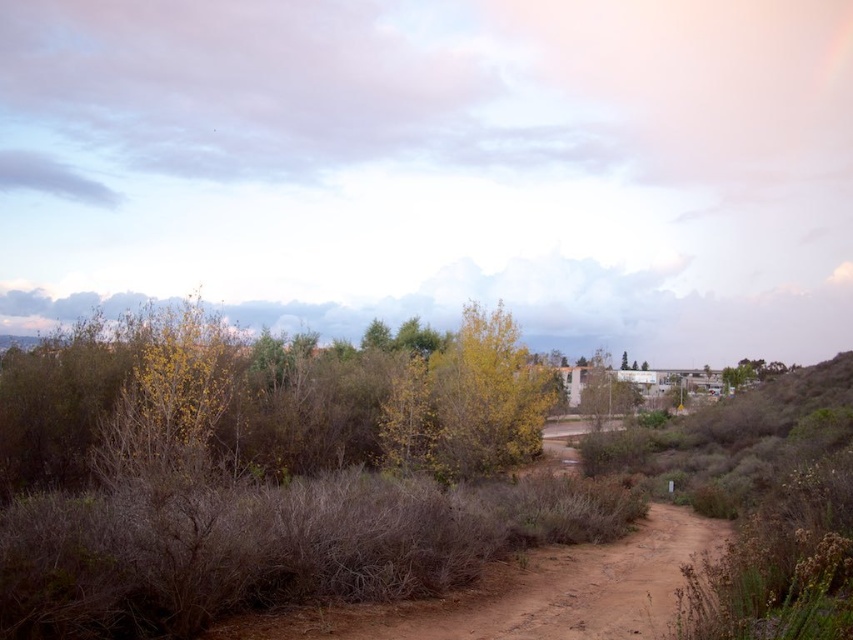
Question: Observing the image, what is the correct spatial positioning of green leafy bush at left in reference to yellow-green leafy tree at center?

Choices:
 (A) right
 (B) left

Answer: (B)

Question: Which is nearer to the green leafy tree at upper right?

Choices:
 (A) yellow-green leafy tree at center
 (B) green leafy bush at left

Answer: (B)

Question: Is green leafy bush at left thinner than yellow-green leafy tree at center?

Choices:
 (A) yes
 (B) no

Answer: (B)

Question: Which of the following is the farthest from the observer?

Choices:
 (A) yellow-green leafy tree at center
 (B) green leafy bush at left
 (C) green leafy tree at upper right

Answer: (C)

Question: Does yellow-green leafy tree at center lie in front of green leafy tree at upper right?

Choices:
 (A) no
 (B) yes

Answer: (B)

Question: Which object is positioned farthest from the yellow-green leafy tree at center?

Choices:
 (A) green leafy bush at left
 (B) green leafy tree at upper right

Answer: (B)